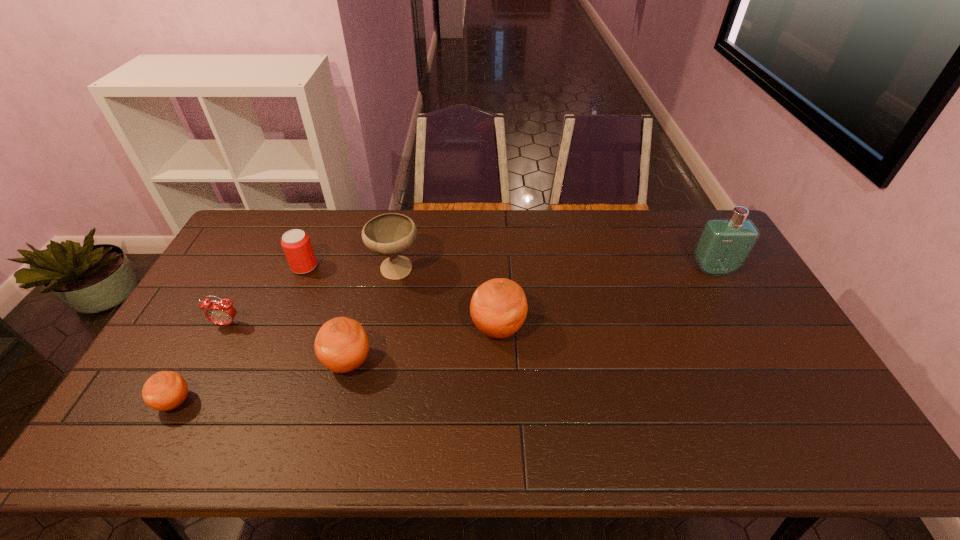
The width and height of the screenshot is (960, 540). In order to click on blank region between the beer can and the shortest object in this screenshot , I will do `click(240, 334)`.

This screenshot has width=960, height=540. Find the location of `free space between the beer can and the perfume`. free space between the beer can and the perfume is located at coordinates (509, 268).

Where is `empty space between the second shortest orange and the alarm clock`? empty space between the second shortest orange and the alarm clock is located at coordinates (288, 343).

Locate an element on the screen. object that is the fourth closest one to the second tallest orange is located at coordinates (166, 390).

Identify the location of object that is the sixth closest one to the rightmost orange. The height and width of the screenshot is (540, 960). (166, 390).

Find the location of a particular element. orange that is the second nearest to the alarm clock is located at coordinates (341, 345).

You are a GUI agent. You are given a task and a screenshot of the screen. Output one action in this format:
    pyautogui.click(x=<x>, y=<y>)
    Task: Click on the orange that is the second closest to the second shortest orange
    Image resolution: width=960 pixels, height=540 pixels.
    Given the screenshot: What is the action you would take?
    pyautogui.click(x=166, y=390)

Identify the location of vacant space that satisfies the following two spatial constraints: 1. on the back side of the chalice; 2. on the left side of the shortest object. The image size is (960, 540). (248, 271).

Where is `blank area in the image that satisfies the following two spatial constraints: 1. on the front side of the second orange from left to right; 2. on the right side of the third object from left to right`? blank area in the image that satisfies the following two spatial constraints: 1. on the front side of the second orange from left to right; 2. on the right side of the third object from left to right is located at coordinates (264, 362).

You are a GUI agent. You are given a task and a screenshot of the screen. Output one action in this format:
    pyautogui.click(x=<x>, y=<y>)
    Task: Click on the vacant region that satisfies the following two spatial constraints: 1. on the front side of the rightmost orange; 2. on the left side of the fifth object from right to left
    The image size is (960, 540).
    Given the screenshot: What is the action you would take?
    pyautogui.click(x=278, y=328)